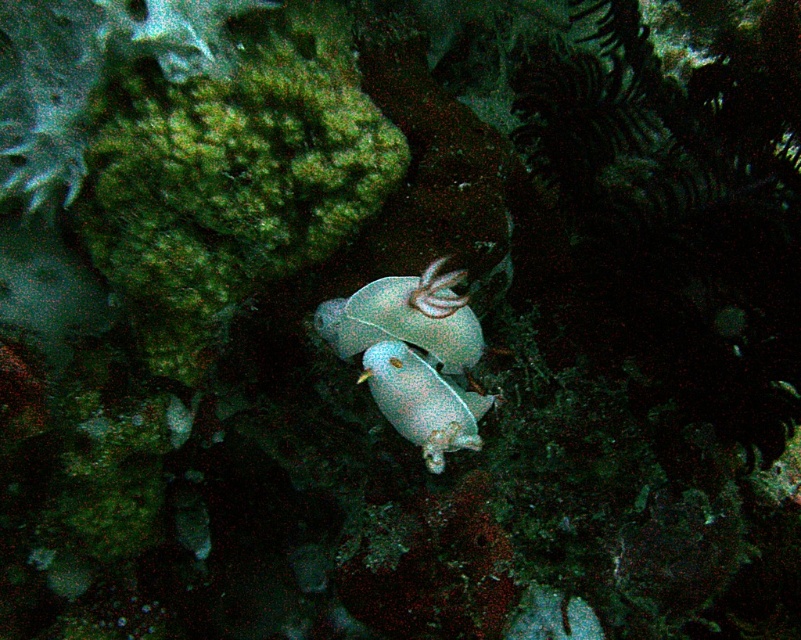
You are an underwater photographer aiming to capture both the translucent blue shell at center and the translucent white fish at center in a single frame. Based on their sizes, will you need to adjust your camera to a wider angle to ensure both fit in the photo?

The translucent blue shell at center might be wider than the translucent white fish at center, so adjusting the camera to a wider angle could help ensure both fit in the photo.